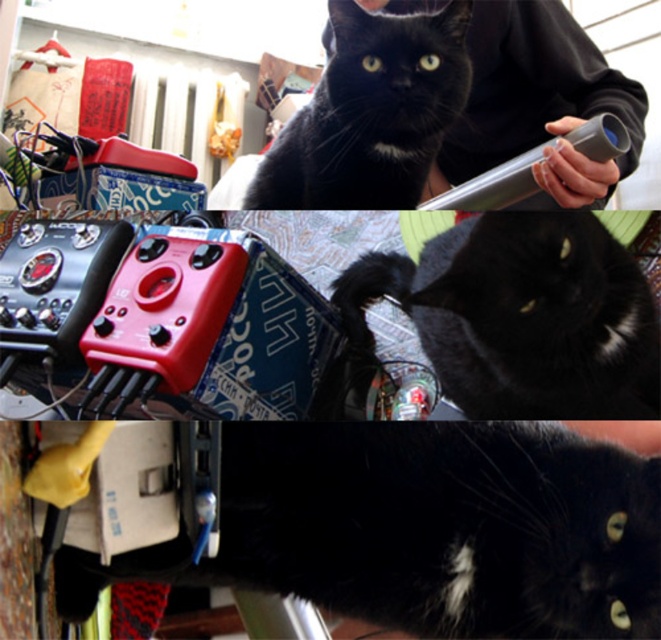
Looking at the collage, you notice two cats in the middle and top images. The top image has a black fur cat at center and the middle image has a black glossy cat at center. Which cat is positioned lower in the collage?

The black fur cat at center is located below the black glossy cat at center, so it is positioned lower in the collage.

You are a photographer trying to arrange the cats in the middle image so that the black glossy cat at center is above the black fur cat at upper center. Is this possible based on their current positions?

The black glossy cat at center is currently located below the black fur cat at upper center, so moving it above would require repositioning them.